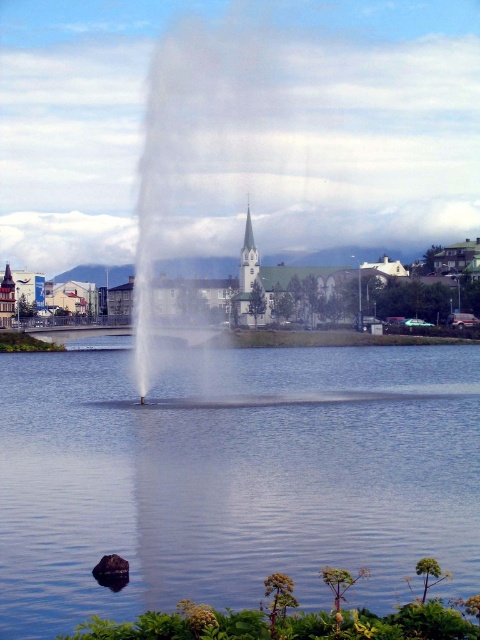
Question: Which of the following is the closest to the observer?

Choices:
 (A) transparent water at center
 (B) white stone spire at center

Answer: (A)

Question: Is transparent water at center thinner than white stone spire at center?

Choices:
 (A) no
 (B) yes

Answer: (A)

Question: Is transparent water at center closer to camera compared to white stone spire at center?

Choices:
 (A) no
 (B) yes

Answer: (B)

Question: Which point is farther to the camera?

Choices:
 (A) transparent water at center
 (B) white stone spire at center

Answer: (B)

Question: Does transparent water at center appear on the left side of white stone spire at center?

Choices:
 (A) yes
 (B) no

Answer: (A)